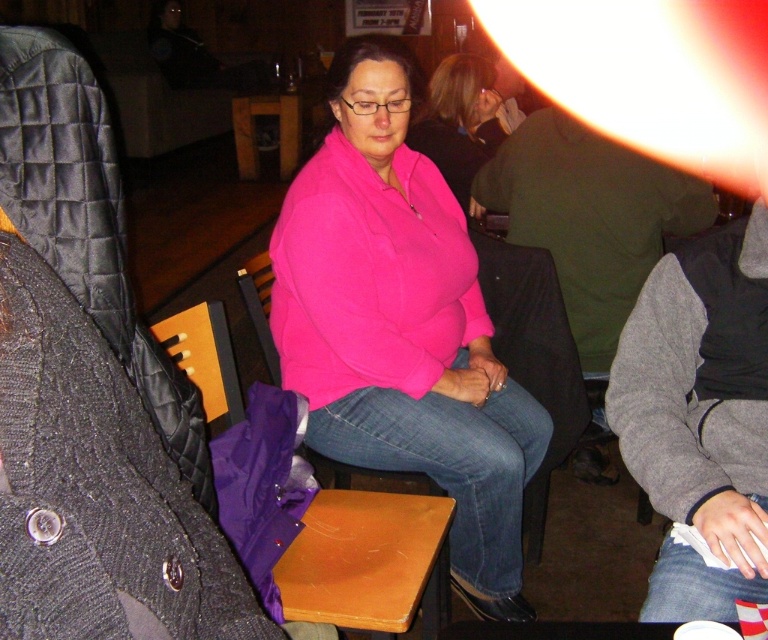
Who is shorter, wooden chair at center or wooden table at center?

wooden chair at center is shorter.

Is wooden chair at center shorter than wooden table at center?

Yes, wooden chair at center is shorter than wooden table at center.

Does point (108, 257) come in front of point (237, 106)?

Yes, point (108, 257) is in front of point (237, 106).

Identify the location of wooden chair at center. The height and width of the screenshot is (640, 768). (85, 221).

Can you confirm if wooden chair at center is positioned below wooden at center?

No.

Who is more forward, (71, 189) or (356, 604)?

Point (71, 189) is in front.

Who is more distant from viewer, (18, 202) or (394, 552)?

Point (394, 552)

Where is `wooden chair at center`? wooden chair at center is located at coordinates (85, 221).

Measure the distance between point [71,49] and camera.

Point [71,49] and camera are 29.29 inches apart.

Locate an element on the screen. The image size is (768, 640). wooden chair at center is located at coordinates (85, 221).